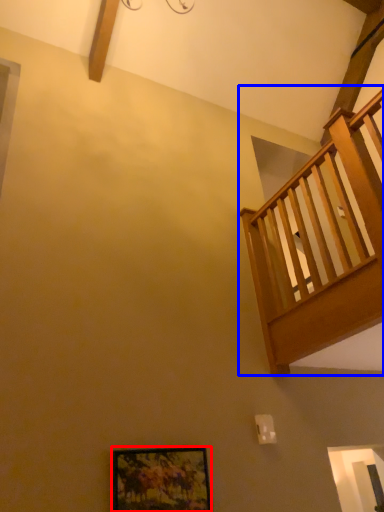
Question: Which of the following is the farthest to the observer, picture frame (highlighted by a red box) or balcony (highlighted by a blue box)?

Choices:
 (A) picture frame
 (B) balcony

Answer: (A)